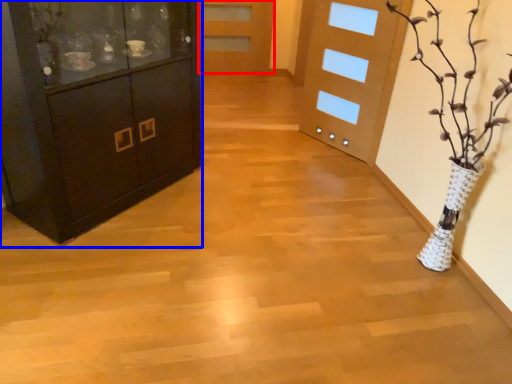
Question: Which object appears farthest to the camera in this image, door (highlighted by a red box) or cabinetry (highlighted by a blue box)?

Choices:
 (A) door
 (B) cabinetry

Answer: (A)